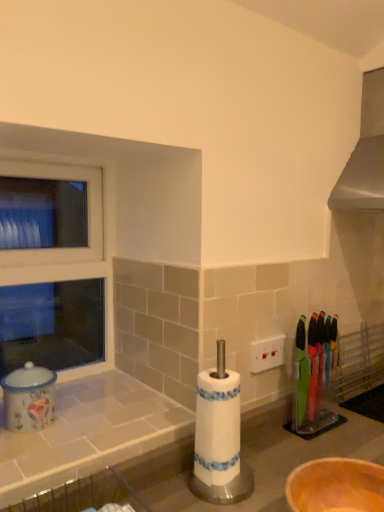
Question: From a real-world perspective, is translucent plastic knives at right positioned above or below matte ceramic coffee canister at left?

Choices:
 (A) above
 (B) below

Answer: (B)

Question: From their relative heights in the image, would you say translucent plastic knives at right is taller or shorter than matte ceramic coffee canister at left?

Choices:
 (A) short
 (B) tall

Answer: (B)

Question: Which object is positioned farthest from the white tile counter at lower left?

Choices:
 (A) translucent plastic knives at right
 (B) wooden bowl at lower right
 (C) matte ceramic coffee canister at left

Answer: (A)

Question: Estimate the real-world distances between objects in this image. Which object is farther from the wooden bowl at lower right?

Choices:
 (A) matte ceramic coffee canister at left
 (B) translucent plastic knives at right
 (C) white tile counter at lower left

Answer: (A)